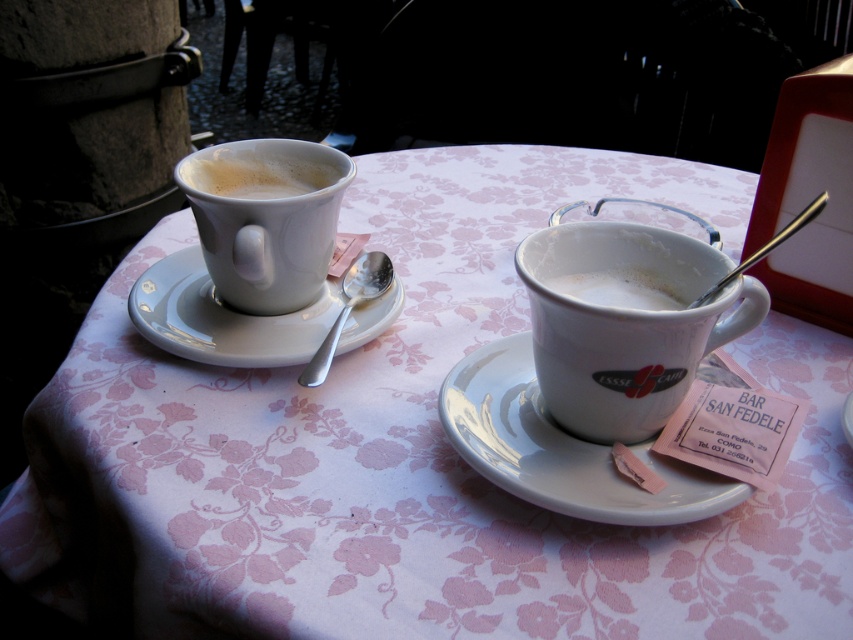
Measure the distance between white ceramic saucer at center and camera.

The distance of white ceramic saucer at center from camera is 12.05 inches.

Find the location of a particular element. This screenshot has width=853, height=640. white ceramic saucer at center is located at coordinates (561, 449).

Is point (445, 385) in front of point (155, 333)?

That is True.

I want to click on white ceramic saucer at center, so click(x=561, y=449).

Does white glossy saucer at left appear on the right side of silver metallic spoon at left?

Incorrect, white glossy saucer at left is not on the right side of silver metallic spoon at left.

Is white glossy saucer at left in front of silver metallic spoon at left?

No, it is not.

Which is in front, point (315, 324) or point (305, 381)?

Point (305, 381) is in front.

Identify the location of white glossy saucer at left. (223, 317).

Identify the location of white ceramic saucer at center. This screenshot has width=853, height=640. (561, 449).

Is white ceramic saucer at center bigger than silver metallic spoon at left?

Correct, white ceramic saucer at center is larger in size than silver metallic spoon at left.

Is point (703, 468) positioned in front of point (379, 252)?

Yes, it is.

In order to click on white ceramic saucer at center in this screenshot , I will do `click(561, 449)`.